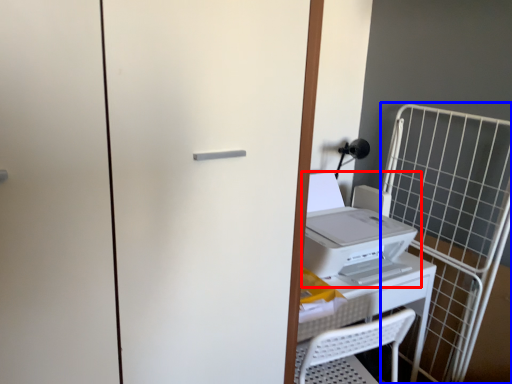
Question: Which object appears closest to the camera in this image, home appliance (highlighted by a red box) or cage (highlighted by a blue box)?

Choices:
 (A) home appliance
 (B) cage

Answer: (A)